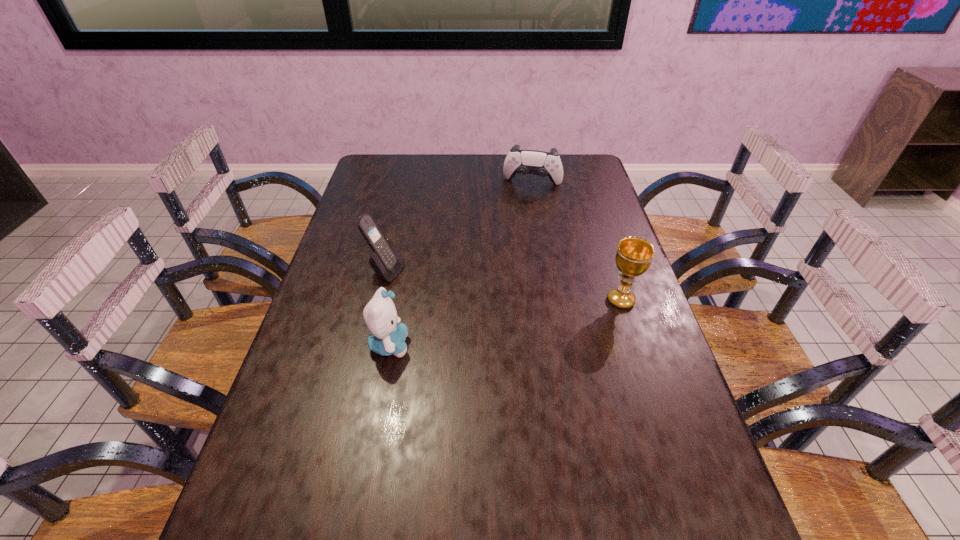
I want to click on free space between the second nearest object and the kitten, so click(505, 322).

Locate an element on the screen. The height and width of the screenshot is (540, 960). free spot between the rightmost object and the nearest object is located at coordinates (505, 322).

Identify which object is the closest to the third nearest object. Please provide its 2D coordinates. Your answer should be formatted as a tuple, i.e. [(x, y)], where the tuple contains the x and y coordinates of a point satisfying the conditions above.

[(388, 335)]

Locate an element on the screen. The width and height of the screenshot is (960, 540). object that is the second closest to the second nearest object is located at coordinates (388, 335).

The width and height of the screenshot is (960, 540). In order to click on free point that satisfies the following two spatial constraints: 1. on the back side of the cellular telephone; 2. on the left side of the farthest object in this screenshot , I will do `click(406, 184)`.